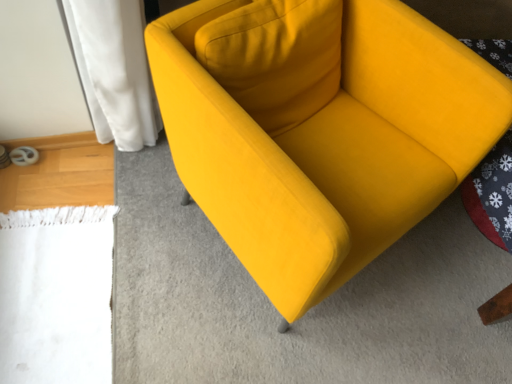
What do you see at coordinates (327, 144) in the screenshot? The image size is (512, 384). I see `velvet yellow armchair at center` at bounding box center [327, 144].

You are a GUI agent. You are given a task and a screenshot of the screen. Output one action in this format:
    pyautogui.click(x=<x>, y=<y>)
    Task: Click on the velvet yellow armchair at center
    
    Given the screenshot: What is the action you would take?
    pyautogui.click(x=327, y=144)

What is the approximate height of velvet yellow armchair at center?

It is 29.38 inches.

Identify the location of velvet yellow armchair at center. (327, 144).